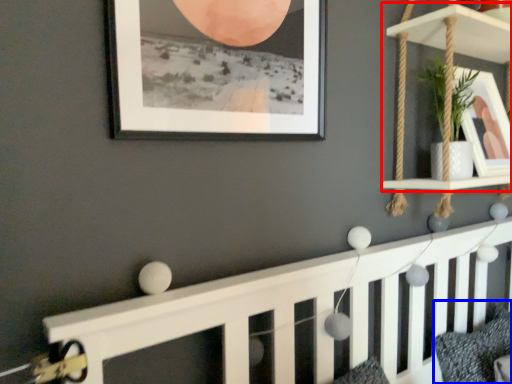
Question: Which object is closer to the camera taking this photo, shelf (highlighted by a red box) or pillow (highlighted by a blue box)?

Choices:
 (A) shelf
 (B) pillow

Answer: (A)